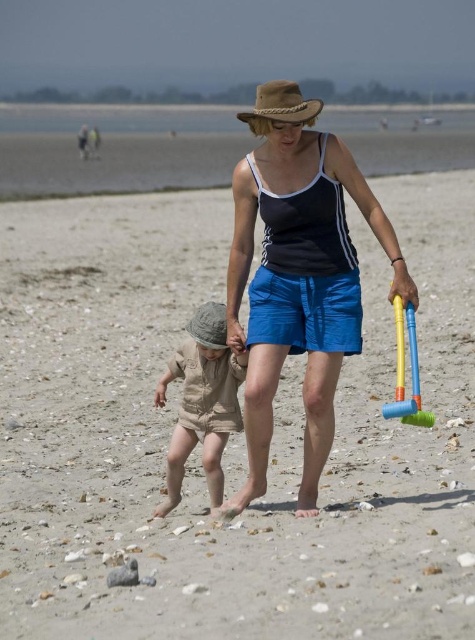
Does matte black tank top at center have a greater height compared to khaki cotton romper at center?

Indeed, matte black tank top at center has a greater height compared to khaki cotton romper at center.

Between point (239, 268) and point (174, 500), which one is positioned behind?

The point (174, 500) is more distant.

Is point (326, 381) farther from viewer compared to point (218, 426)?

No, (326, 381) is in front of (218, 426).

This screenshot has width=475, height=640. In order to click on matte black tank top at center in this screenshot , I will do `click(298, 285)`.

Which is behind, point (219, 305) or point (411, 394)?

The point (411, 394) is more distant.

Is point (199, 339) closer to camera compared to point (417, 419)?

No, it is not.

Locate an element on the screen. khaki cotton romper at center is located at coordinates (202, 401).

Can you confirm if fine-grained sand at center is positioned above blue plastic shovel at right?

Correct, fine-grained sand at center is located above blue plastic shovel at right.

Who is more forward, (65,404) or (419,419)?

Result: Point (419,419)

Between point (336, 586) and point (410, 307), which one is positioned behind?

Point (410, 307)

This screenshot has width=475, height=640. I want to click on fine-grained sand at center, so click(x=199, y=448).